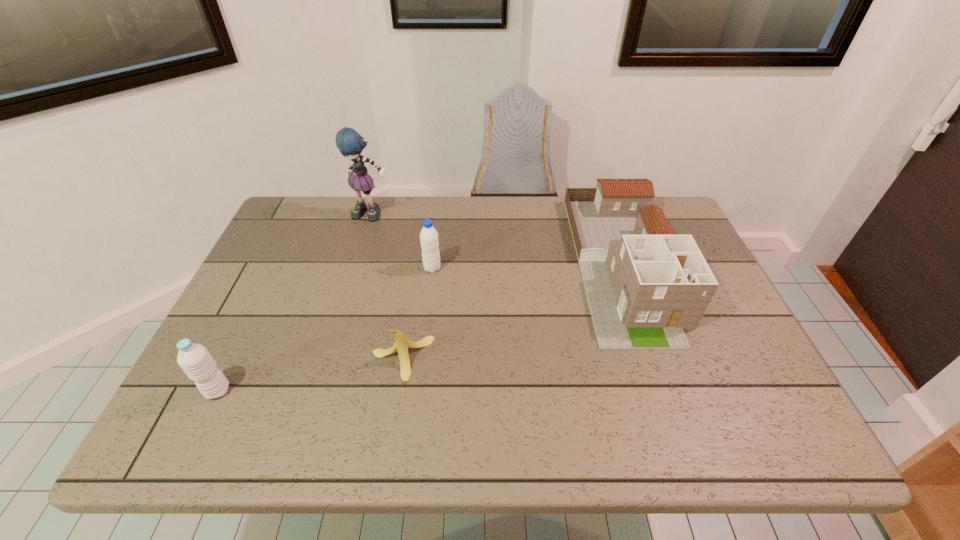
Image resolution: width=960 pixels, height=540 pixels. I want to click on vacant region located 0.360m on the back of the left water bottle, so click(277, 268).

The width and height of the screenshot is (960, 540). What are the coordinates of `vacant area situated on the right of the farther water bottle` in the screenshot? It's located at (463, 268).

Where is `vacant position located on the left of the banana`? vacant position located on the left of the banana is located at coordinates (213, 359).

You are a GUI agent. You are given a task and a screenshot of the screen. Output one action in this format:
    pyautogui.click(x=<x>, y=<y>)
    Task: Click on the rag doll positioned at the far edge
    
    Given the screenshot: What is the action you would take?
    pyautogui.click(x=350, y=143)

This screenshot has width=960, height=540. I want to click on dollhouse present at the far edge, so click(x=644, y=284).

Locate an element on the screen. Image resolution: width=960 pixels, height=540 pixels. object positioned at the left edge is located at coordinates (195, 360).

Image resolution: width=960 pixels, height=540 pixels. I want to click on object at the right edge, so click(x=644, y=284).

Find the location of a particular element. The height and width of the screenshot is (540, 960). object that is at the far right corner is located at coordinates (644, 284).

The width and height of the screenshot is (960, 540). In order to click on vacant area at the far edge of the desktop in this screenshot , I will do `click(513, 242)`.

Locate an element on the screen. This screenshot has width=960, height=540. free space at the left edge of the desktop is located at coordinates (256, 286).